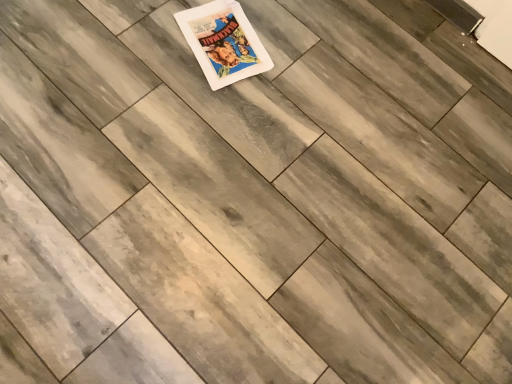
Identify the location of matte white comic book at upper center. (223, 42).

The height and width of the screenshot is (384, 512). What do you see at coordinates (223, 42) in the screenshot? I see `matte white comic book at upper center` at bounding box center [223, 42].

At what (x,y) coordinates should I click in order to perform the action: click on matte white comic book at upper center. Please return your answer as a coordinate pair (x, y). Looking at the image, I should click on (223, 42).